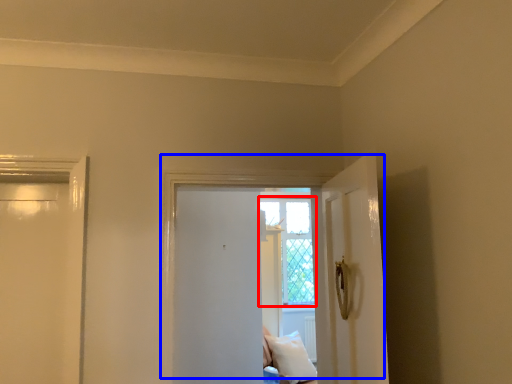
Question: Which object is closer to the camera taking this photo, window (highlighted by a red box) or door (highlighted by a blue box)?

Choices:
 (A) window
 (B) door

Answer: (B)